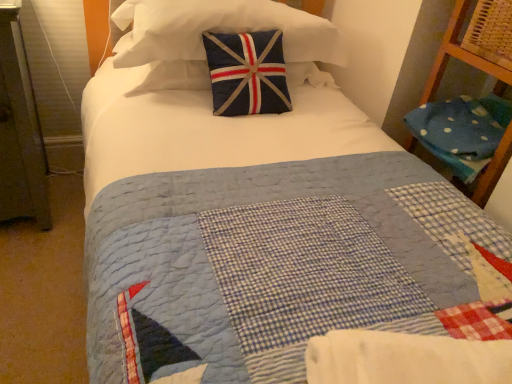
Question: Can you confirm if white cotton blanket at center is shorter than navy blue fabric pillow at upper center, which is the 1th pillow from top to bottom?

Choices:
 (A) yes
 (B) no

Answer: (A)

Question: Is white cotton blanket at center wider than navy blue fabric pillow at upper center, the second pillow when ordered from right to left?

Choices:
 (A) yes
 (B) no

Answer: (B)

Question: From a real-world perspective, is white cotton blanket at center under navy blue fabric pillow at upper center, which is the 1th pillow from top to bottom?

Choices:
 (A) yes
 (B) no

Answer: (A)

Question: Is white cotton blanket at center at the left side of navy blue fabric pillow at upper center, the second pillow when ordered from right to left?

Choices:
 (A) no
 (B) yes

Answer: (A)

Question: Is white cotton blanket at center looking in the opposite direction of navy blue fabric pillow at upper center, the second pillow when ordered from right to left?

Choices:
 (A) yes
 (B) no

Answer: (A)

Question: Considering the positions of point (259, 18) and point (497, 97), is point (259, 18) closer or farther from the camera than point (497, 97)?

Choices:
 (A) closer
 (B) farther

Answer: (A)

Question: Considering their positions, is navy blue fabric pillow at upper center, acting as the first pillow starting from the left, located in front of or behind blue polka dot fabric at right, which is the 1th pillow from right to left?

Choices:
 (A) front
 (B) behind

Answer: (A)

Question: Considering the relative positions of navy blue fabric pillow at upper center, the 2th pillow in the bottom-to-top sequence, and blue polka dot fabric at right, positioned as the 2th pillow in top-to-bottom order, in the image provided, is navy blue fabric pillow at upper center, the 2th pillow in the bottom-to-top sequence, to the left or to the right of blue polka dot fabric at right, positioned as the 2th pillow in top-to-bottom order,?

Choices:
 (A) right
 (B) left

Answer: (B)

Question: Considering the positions of navy blue fabric pillow at upper center, which is the 1th pillow from top to bottom, and blue polka dot fabric at right, which is the 1th pillow from right to left, in the image, is navy blue fabric pillow at upper center, which is the 1th pillow from top to bottom, taller or shorter than blue polka dot fabric at right, which is the 1th pillow from right to left,?

Choices:
 (A) tall
 (B) short

Answer: (A)

Question: From the image's perspective, is blue polka dot fabric at right, which appears as the 2th pillow when viewed from the left, positioned above or below navy blue fabric pillow at upper center, acting as the first pillow starting from the left?

Choices:
 (A) above
 (B) below

Answer: (B)

Question: In terms of size, does blue polka dot fabric at right, which is the 1th pillow from right to left, appear bigger or smaller than navy blue fabric pillow at upper center, acting as the first pillow starting from the left?

Choices:
 (A) big
 (B) small

Answer: (B)

Question: Is blue polka dot fabric at right, which appears as the 2th pillow when viewed from the left, taller or shorter than navy blue fabric pillow at upper center, which is the 1th pillow from top to bottom?

Choices:
 (A) short
 (B) tall

Answer: (A)

Question: From a real-world perspective, relative to navy blue fabric pillow at upper center, the second pillow when ordered from right to left, is blue polka dot fabric at right, positioned as the 2th pillow in top-to-bottom order, vertically above or below?

Choices:
 (A) below
 (B) above

Answer: (A)

Question: Is navy blue fabric pillow at upper center, the second pillow when ordered from right to left, in front of or behind white cotton blanket at center in the image?

Choices:
 (A) behind
 (B) front

Answer: (A)

Question: Do you think navy blue fabric pillow at upper center, the 2th pillow in the bottom-to-top sequence, is within white cotton blanket at center, or outside of it?

Choices:
 (A) inside
 (B) outside

Answer: (B)